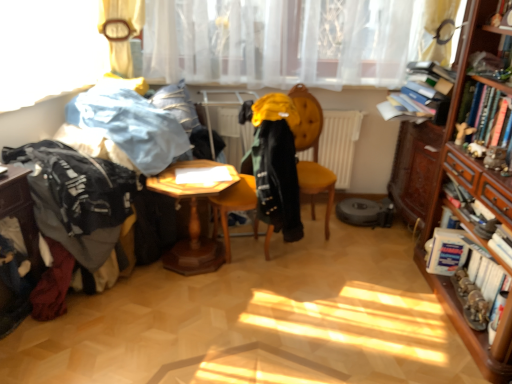
I want to click on free space in front of velvet yellow chair at center, so click(x=325, y=263).